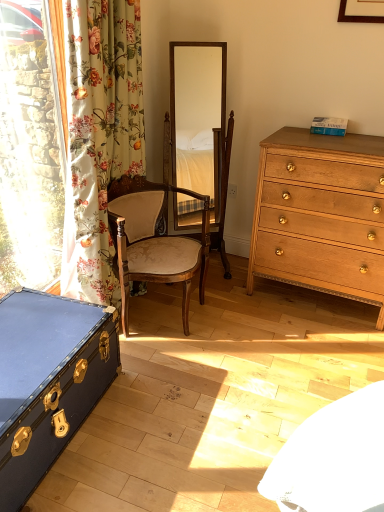
Question: Does white plastic power outlet at center lie behind light brown wood chest of drawers at right?

Choices:
 (A) no
 (B) yes

Answer: (B)

Question: Is white plastic power outlet at center taller than light brown wood chest of drawers at right?

Choices:
 (A) no
 (B) yes

Answer: (A)

Question: Considering the relative sizes of white plastic power outlet at center and light brown wood chest of drawers at right in the image provided, is white plastic power outlet at center shorter than light brown wood chest of drawers at right?

Choices:
 (A) yes
 (B) no

Answer: (A)

Question: Is white plastic power outlet at center at the right side of light brown wood chest of drawers at right?

Choices:
 (A) no
 (B) yes

Answer: (A)

Question: From the image's perspective, is white plastic power outlet at center located beneath light brown wood chest of drawers at right?

Choices:
 (A) yes
 (B) no

Answer: (B)

Question: Is white plastic power outlet at center positioned in front of light brown wood chest of drawers at right?

Choices:
 (A) yes
 (B) no

Answer: (B)

Question: Is white plastic power outlet at center outside wooden chair at center?

Choices:
 (A) no
 (B) yes

Answer: (B)

Question: Is white plastic power outlet at center wider than wooden chair at center?

Choices:
 (A) yes
 (B) no

Answer: (B)

Question: Is white plastic power outlet at center not near wooden chair at center?

Choices:
 (A) no
 (B) yes

Answer: (A)

Question: Is white plastic power outlet at center smaller than wooden chair at center?

Choices:
 (A) no
 (B) yes

Answer: (B)

Question: Considering the relative sizes of white plastic power outlet at center and wooden chair at center in the image provided, is white plastic power outlet at center taller than wooden chair at center?

Choices:
 (A) yes
 (B) no

Answer: (B)

Question: From a real-world perspective, is white plastic power outlet at center beneath wooden chair at center?

Choices:
 (A) yes
 (B) no

Answer: (B)

Question: Does wooden mirror at center turn towards wooden chair at center?

Choices:
 (A) yes
 (B) no

Answer: (A)